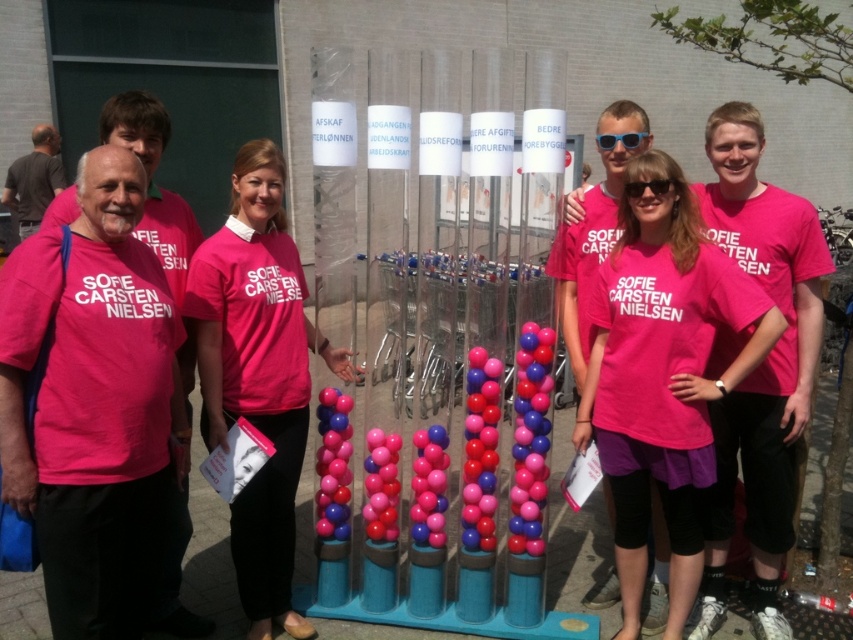
You are a photographer taking a group photo of the seven individuals wearing bright pink Tshirts. You notice two shirts at the center of the group labeled as pink matte shirt at center and pink fabric shirt at center. Which shirt should you focus on to ensure it appears wider in the final photo?

You should focus on the pink matte shirt at center because its width is larger than the pink fabric shirt at center.

You are standing at the base of the cylindrical structure and want to reach the point marked by point (701, 241) first before reaching point (288, 355). Which direction should you move first?

Since point (701, 241) is in front of point (288, 355), you should move forward towards point (701, 241) first.